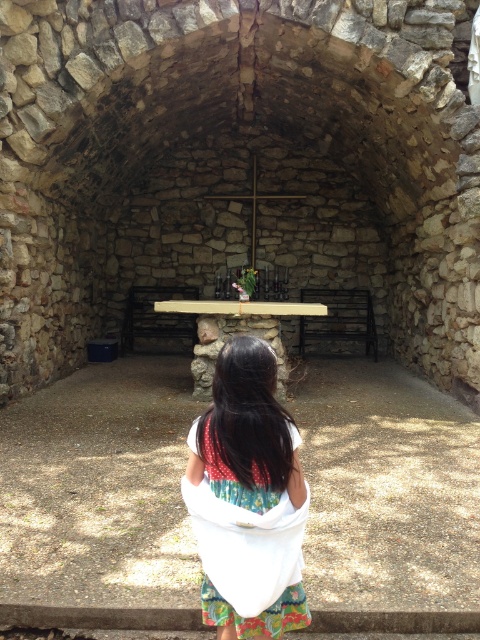
Question: Can you confirm if brown stone table at center is positioned above white fabric at center?

Choices:
 (A) yes
 (B) no

Answer: (B)

Question: Is brown stone table at center above white fabric at center?

Choices:
 (A) no
 (B) yes

Answer: (A)

Question: Which of the following is the farthest from the observer?

Choices:
 (A) brown stone table at center
 (B) white fabric at center

Answer: (A)

Question: Can you confirm if brown stone table at center is wider than white fabric at center?

Choices:
 (A) yes
 (B) no

Answer: (A)

Question: Which point is farther from the camera taking this photo?

Choices:
 (A) (304, 618)
 (B) (15, 592)

Answer: (B)